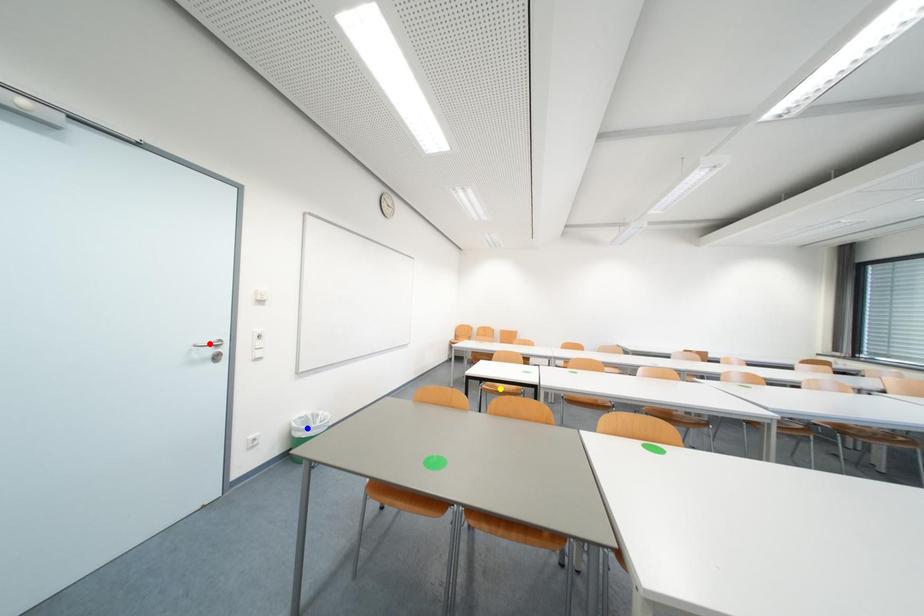
Order these from nearest to farthest:
- yellow point
- blue point
- red point

red point → blue point → yellow point